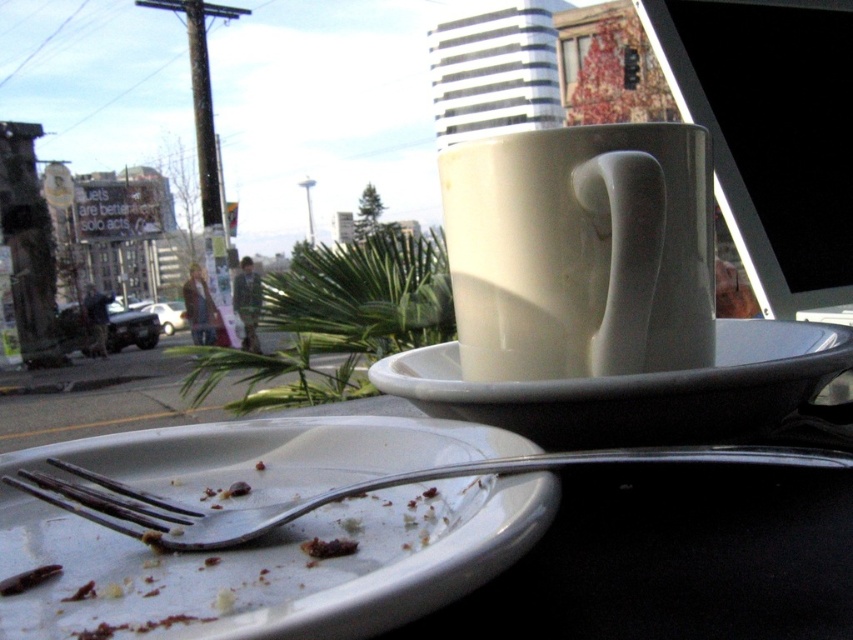
Between point (258, 548) and point (801, 406), which one is positioned behind?

The point (801, 406) is behind.

Is white matte plate at lower left bigger than white matte saucer at center?

Yes, white matte plate at lower left is bigger than white matte saucer at center.

I want to click on white matte plate at lower left, so click(x=276, y=566).

Which is behind, point (489, 250) or point (718, 401)?

The point (489, 250) is behind.

Can you confirm if white ceramic mug at upper center is taller than white matte saucer at center?

Yes, white ceramic mug at upper center is taller than white matte saucer at center.

Based on the photo, who is more forward, [511,236] or [721,420]?

Point [721,420] is in front.

Where is `white ceramic mug at upper center`? This screenshot has width=853, height=640. white ceramic mug at upper center is located at coordinates (x=579, y=252).

Measure the distance between white matte plate at lower left and camera.

white matte plate at lower left is 6.09 inches away from camera.

Does white matte plate at lower left appear on the left side of white ceramic mug at upper center?

Yes, white matte plate at lower left is to the left of white ceramic mug at upper center.

Where is `white matte plate at lower left`? white matte plate at lower left is located at coordinates (276, 566).